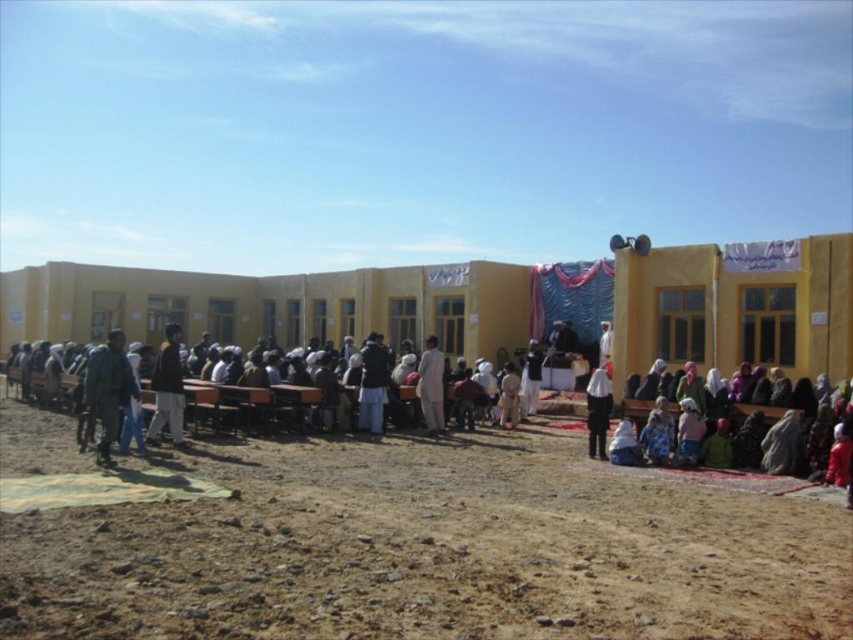
Does point (93, 396) come farther from viewer compared to point (440, 387)?

No, it is not.

Who is more distant from viewer, [108,349] or [433,403]?

Positioned behind is point [433,403].

Where is `dark blue jeans at left`? The height and width of the screenshot is (640, 853). dark blue jeans at left is located at coordinates (x=108, y=390).

The image size is (853, 640). In order to click on dark brown leather jacket at left in this screenshot , I will do `click(167, 388)`.

Is dark brown leather jacket at left wider than light beige fabric at center?

Correct, the width of dark brown leather jacket at left exceeds that of light beige fabric at center.

The height and width of the screenshot is (640, 853). Describe the element at coordinates (167, 388) in the screenshot. I see `dark brown leather jacket at left` at that location.

Find the location of a particular element. The height and width of the screenshot is (640, 853). dark brown leather jacket at left is located at coordinates (167, 388).

Is dark brown leather jacket at left positioned in front of dark blue fabric at center?

Yes, dark brown leather jacket at left is in front of dark blue fabric at center.

Can you confirm if dark brown leather jacket at left is positioned to the left of dark blue fabric at center?

Yes, dark brown leather jacket at left is to the left of dark blue fabric at center.

Where is `dark brown leather jacket at left`? The height and width of the screenshot is (640, 853). dark brown leather jacket at left is located at coordinates (167, 388).